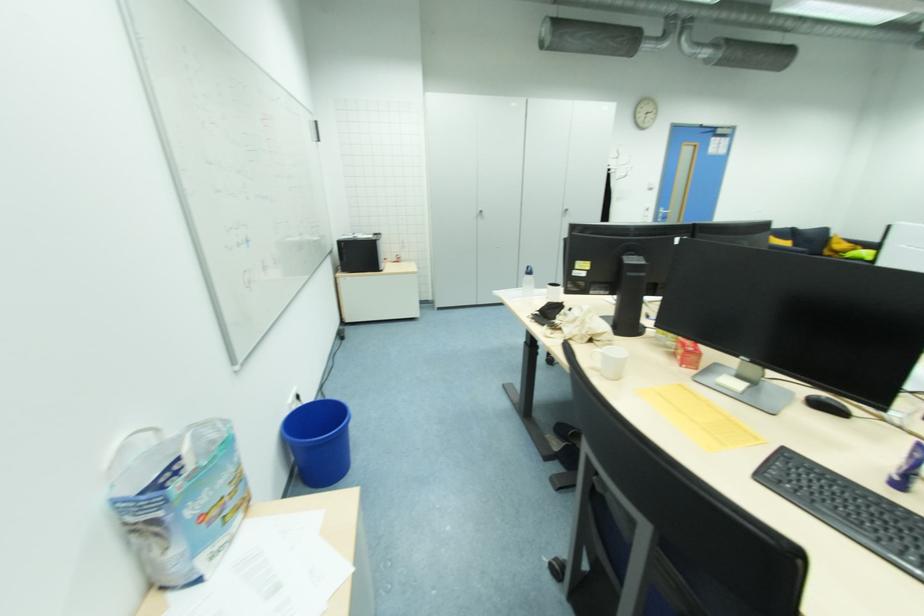
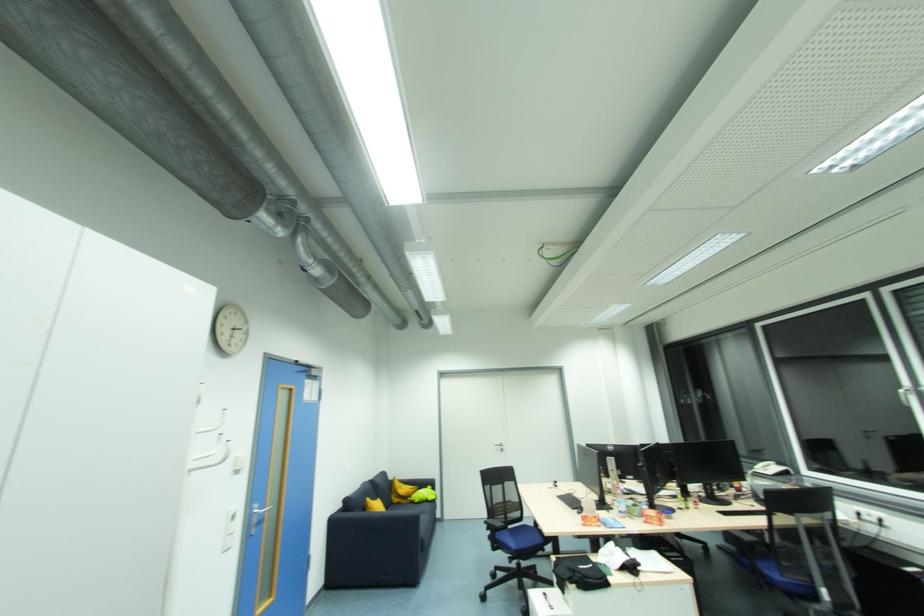
Find the pixel in the second image that matches the point at 666,215 in the first image.

(261, 517)